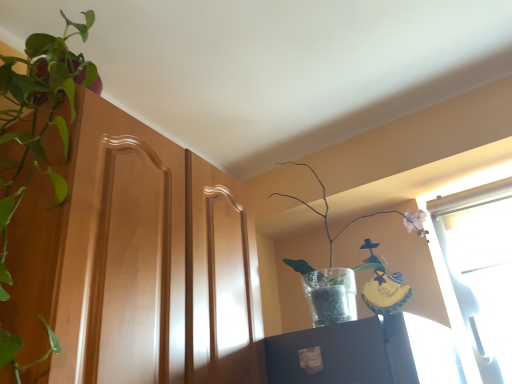
Question: Do you think translucent glass vase at upper right, positioned as the first houseplant in right-to-left order, is within wooden cabinet at left, or outside of it?

Choices:
 (A) inside
 (B) outside

Answer: (B)

Question: Is translucent glass vase at upper right, the 2th houseplant viewed from the left, wider or thinner than wooden cabinet at left?

Choices:
 (A) thin
 (B) wide

Answer: (A)

Question: Which of these objects is positioned farthest from the green leafy plant at left, arranged as the 2th houseplant when viewed from the right?

Choices:
 (A) translucent glass vase at upper right, the 2th houseplant viewed from the left
 (B) wooden cabinet at left

Answer: (A)

Question: Estimate the real-world distances between objects in this image. Which object is closer to the translucent glass vase at upper right, positioned as the first houseplant in right-to-left order?

Choices:
 (A) green leafy plant at left, arranged as the 2th houseplant when viewed from the right
 (B) wooden cabinet at left

Answer: (B)